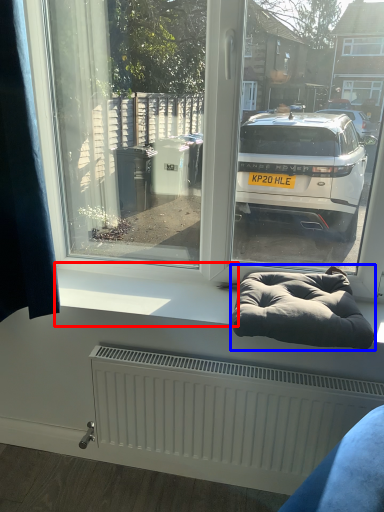
Question: Which of the following is the closest to the observer, window sill (highlighted by a red box) or bean bag chair (highlighted by a blue box)?

Choices:
 (A) window sill
 (B) bean bag chair

Answer: (B)